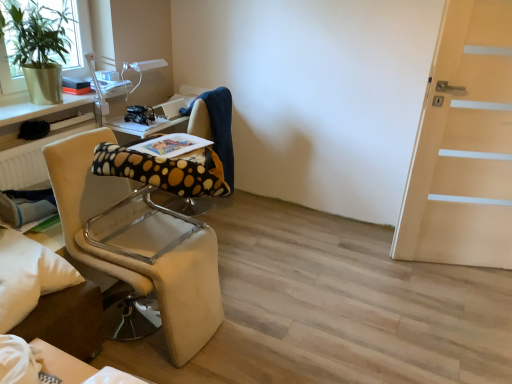
The height and width of the screenshot is (384, 512). In order to click on free point to the left of light wood door at right in this screenshot , I will do `click(380, 266)`.